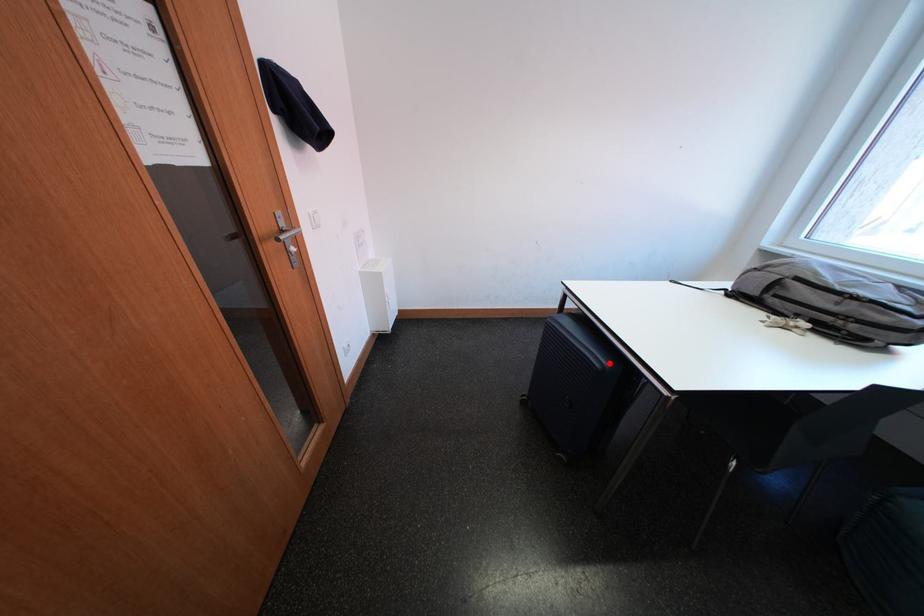
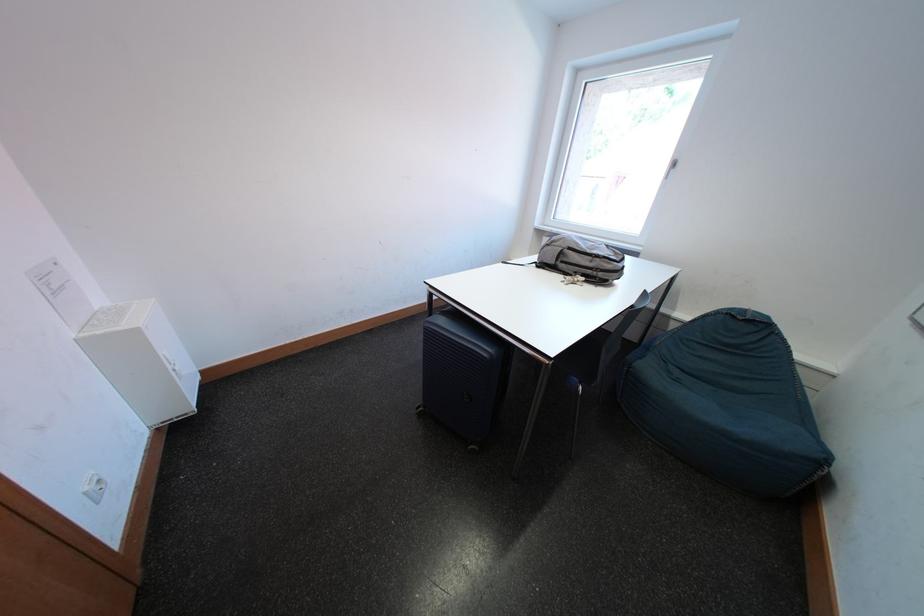
Find the pixel in the second image that matches the highlighted location in the first image.

(495, 353)